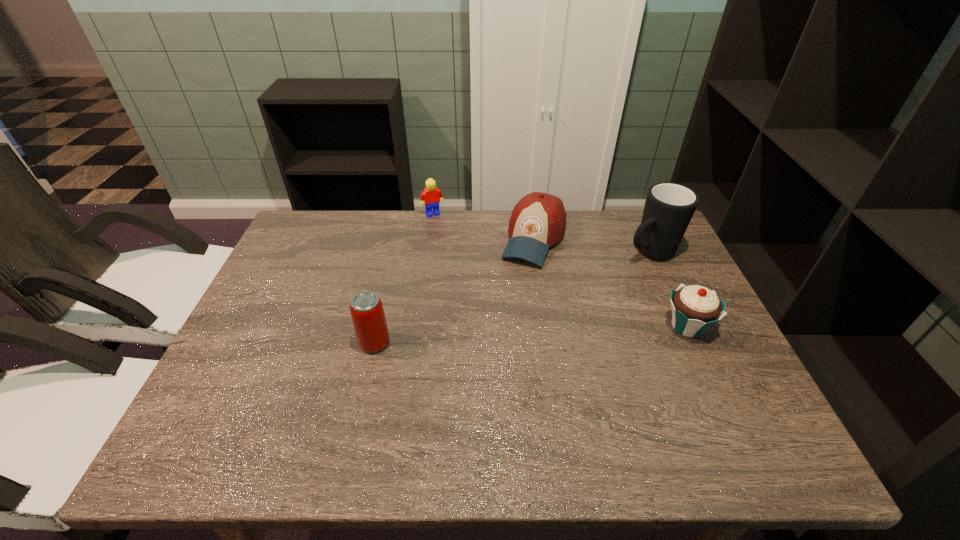
Identify the location of vacant space located 0.390m on the front-facing side of the second object from left to right. (472, 295).

Locate an element on the screen. free region located 0.400m on the front-facing side of the second object from left to right is located at coordinates (474, 298).

Image resolution: width=960 pixels, height=540 pixels. Identify the location of vacant region located on the front-facing side of the second object from left to right. (469, 288).

What are the coordinates of `blank space located on the side of the tallest object with the handle` in the screenshot? It's located at point(595,282).

At what (x,y) coordinates should I click in order to perform the action: click on vacant space located on the side of the tallest object with the handle. Please return your answer as a coordinate pair (x, y). The width and height of the screenshot is (960, 540). Looking at the image, I should click on (541, 313).

The width and height of the screenshot is (960, 540). In order to click on vacant space located on the side of the tallest object with the handle in this screenshot , I will do `click(533, 318)`.

This screenshot has width=960, height=540. Find the location of `baseball cap located at the far edge`. baseball cap located at the far edge is located at coordinates (538, 221).

Find the location of a particular element. Image resolution: width=960 pixels, height=540 pixels. Lego located in the far edge section of the desktop is located at coordinates (432, 196).

The height and width of the screenshot is (540, 960). Find the location of `mug present at the far edge`. mug present at the far edge is located at coordinates (669, 207).

Locate an element on the screen. This screenshot has width=960, height=540. cupcake that is at the right edge is located at coordinates (695, 308).